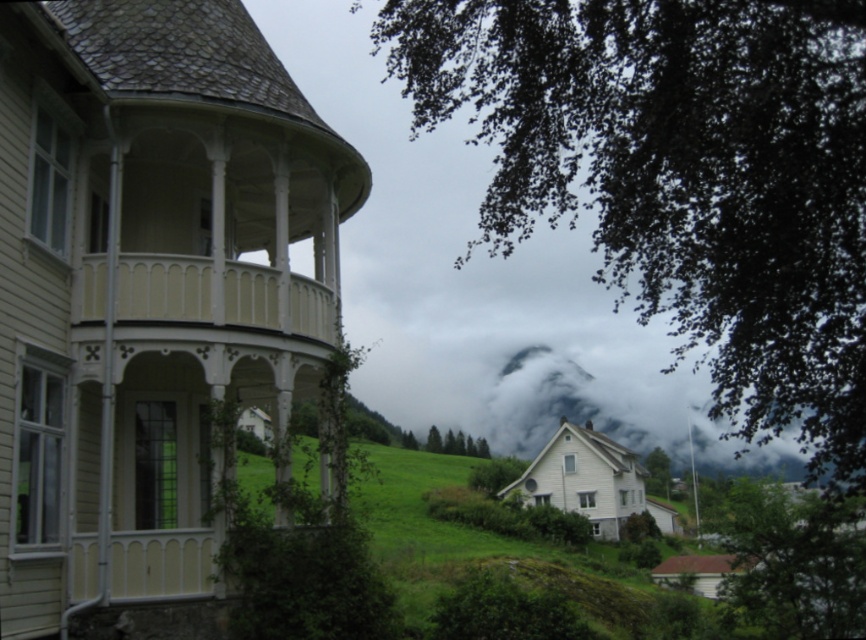
Question: Which of the following is the farthest from the observer?

Choices:
 (A) matte white gazebo at center
 (B) green leafy tree at center
 (C) green leafy tree at upper left
 (D) green leafy tree at lower right

Answer: (B)

Question: Estimate the real-world distances between objects in this image. Which object is farther from the green leafy tree at lower right?

Choices:
 (A) matte white gazebo at center
 (B) green leafy tree at center

Answer: (A)

Question: Is green leafy tree at upper left above green leafy tree at center?

Choices:
 (A) no
 (B) yes

Answer: (B)

Question: Which point is farther from the camera taking this photo?

Choices:
 (A) (428, 433)
 (B) (567, 140)

Answer: (A)

Question: Can you confirm if green leafy tree at upper left is positioned to the left of green leafy tree at center?

Choices:
 (A) no
 (B) yes

Answer: (A)

Question: Does green leafy tree at upper left have a greater width compared to green leafy tree at lower right?

Choices:
 (A) yes
 (B) no

Answer: (A)